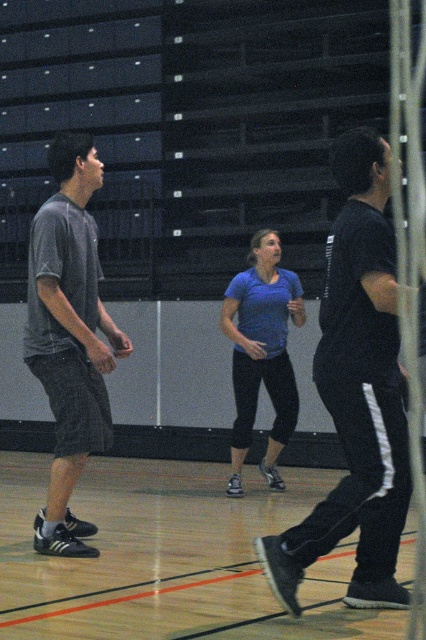
Question: Estimate the real-world distances between objects in this image. Which object is farther from the blue matte shirt at center?

Choices:
 (A) dark gray shorts at left
 (B) wooden floor at center

Answer: (A)

Question: Considering the relative positions of black matte pants at right and dark gray shorts at left in the image provided, where is black matte pants at right located with respect to dark gray shorts at left?

Choices:
 (A) above
 (B) below

Answer: (B)

Question: Does black matte pants at right appear on the right side of blue matte shirt at center?

Choices:
 (A) no
 (B) yes

Answer: (B)

Question: Which object is positioned closest to the blue matte shirt at center?

Choices:
 (A) dark gray shorts at left
 (B) wooden floor at center

Answer: (B)

Question: Which point is farther from the camera taking this photo?

Choices:
 (A) (259, 300)
 (B) (89, 388)
 (C) (325, 547)
 (D) (143, 547)

Answer: (A)

Question: Is black matte pants at right bigger than dark gray shorts at left?

Choices:
 (A) yes
 (B) no

Answer: (B)